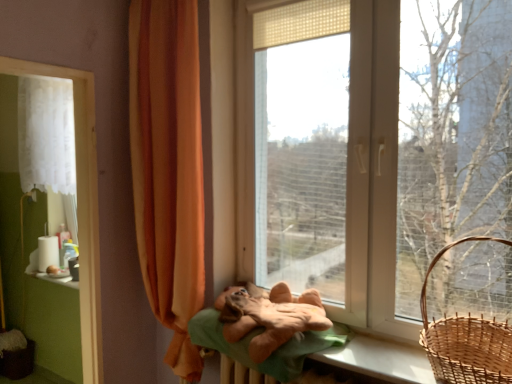
Where is `empty space that is ontop of white fabric at left (from a real-world perspective)`? Image resolution: width=512 pixels, height=384 pixels. empty space that is ontop of white fabric at left (from a real-world perspective) is located at coordinates (39, 56).